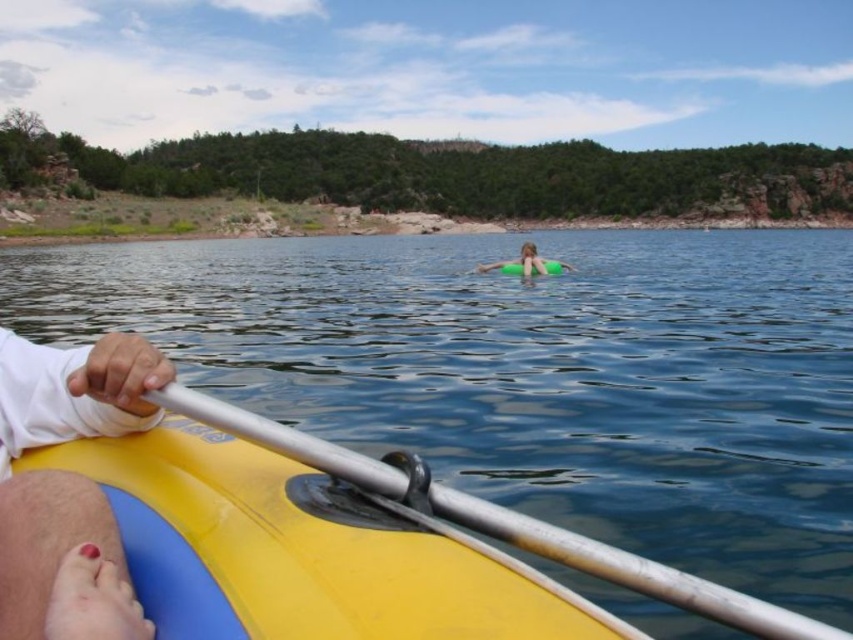
Question: Is silver metallic paddle at lower left bigger than green rubber ring at center?

Choices:
 (A) yes
 (B) no

Answer: (B)

Question: Among these objects, which one is nearest to the camera?

Choices:
 (A) white matte paddle at lower left
 (B) silver metallic paddle at lower left
 (C) green rubber ring at center

Answer: (B)

Question: Does silver metallic paddle at lower left appear on the right side of green rubber ring at center?

Choices:
 (A) no
 (B) yes

Answer: (A)

Question: Does white matte paddle at lower left come behind silver metallic paddle at lower left?

Choices:
 (A) yes
 (B) no

Answer: (A)

Question: Which object is farther from the camera taking this photo?

Choices:
 (A) white matte paddle at lower left
 (B) green rubber ring at center
 (C) silver metallic paddle at lower left

Answer: (B)

Question: Which object is farther from the camera taking this photo?

Choices:
 (A) silver metallic paddle at lower left
 (B) green rubber ring at center

Answer: (B)